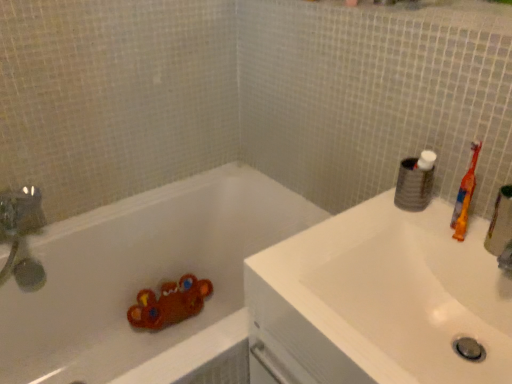
Locate an element on the screen. This screenshot has height=384, width=512. free spot to the left of orange plastic toothbrush at right is located at coordinates (395, 231).